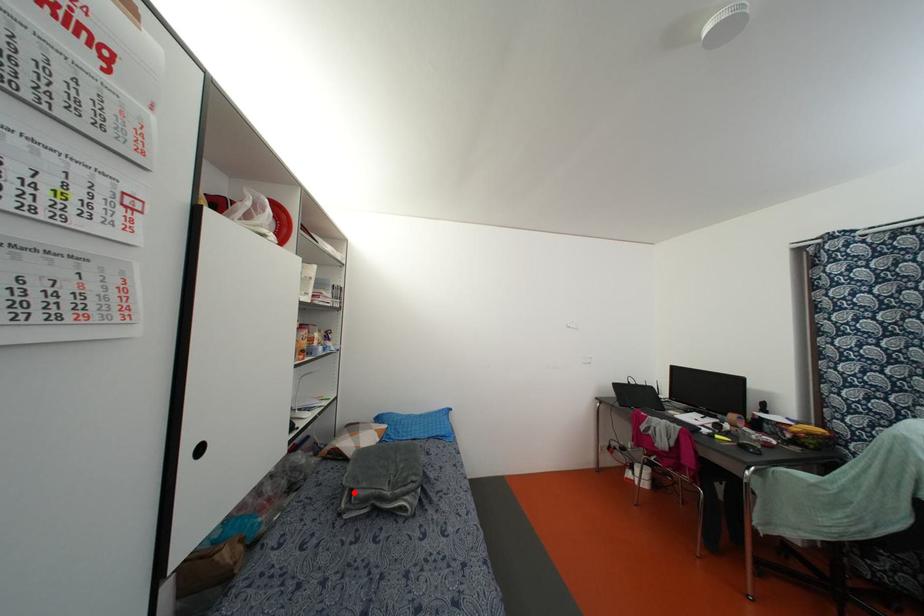
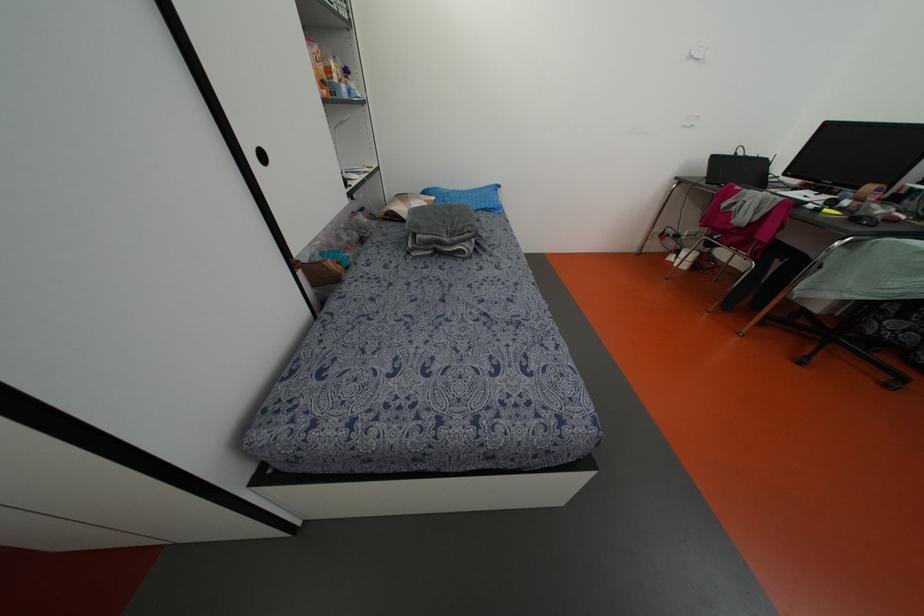
Question: I am providing you with two images of the same scene from different viewpoints. Image1 has a red point marked. In image2, the corresponding 3D location appears at what relative position? Reply with the corresponding letter.

Choices:
 (A) Closer
 (B) Farther

Answer: (A)